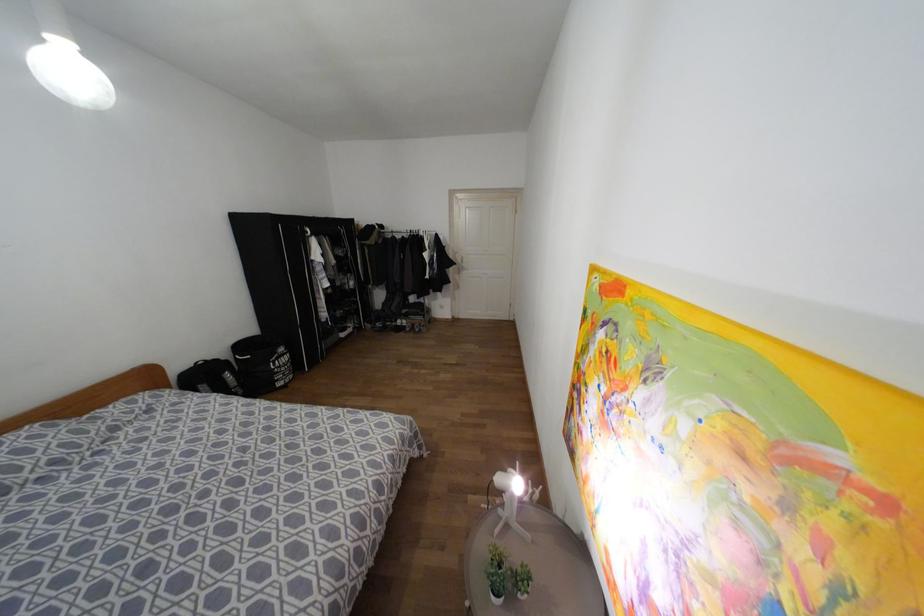
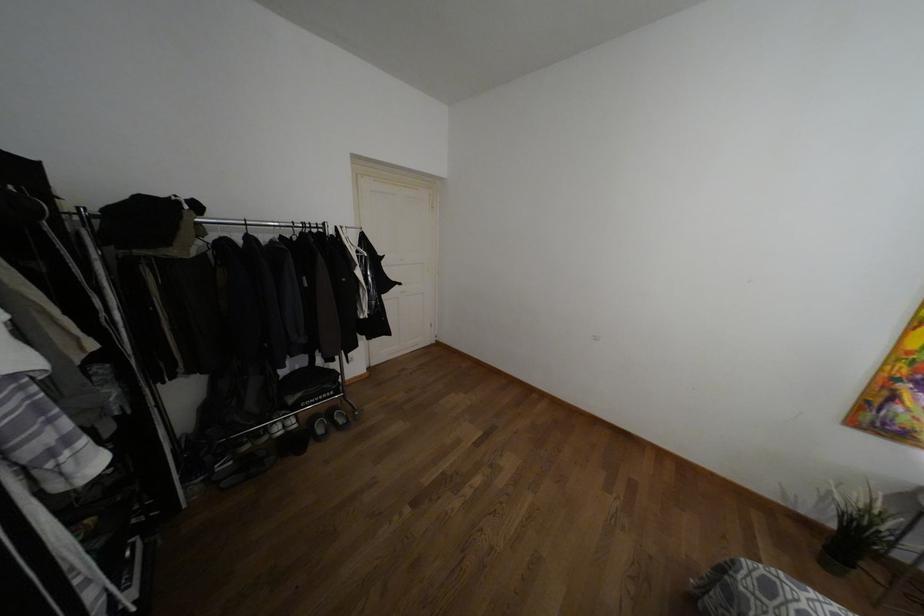
The point at (407, 329) is marked in the first image. Where is the corresponding point in the second image?

(320, 430)